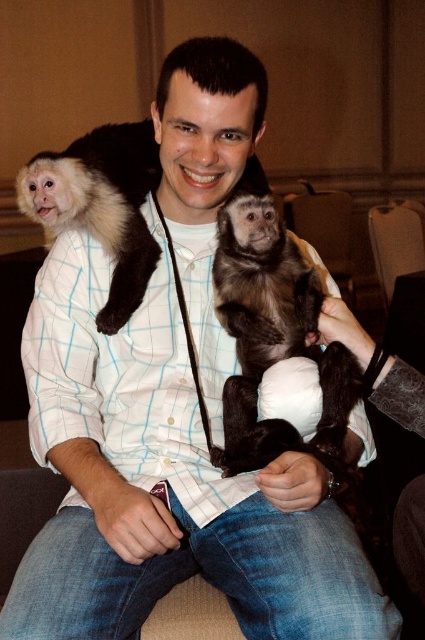
Does brown furry monkey at center have a smaller size compared to dark brown fur monkey at upper left?

Indeed, brown furry monkey at center has a smaller size compared to dark brown fur monkey at upper left.

Image resolution: width=425 pixels, height=640 pixels. What do you see at coordinates (274, 339) in the screenshot?
I see `brown furry monkey at center` at bounding box center [274, 339].

Does point (328, 458) come in front of point (47, 236)?

Yes, point (328, 458) is in front of point (47, 236).

Find the location of `brown furry monkey at center`. brown furry monkey at center is located at coordinates (274, 339).

Is brown furry monkey at center positioned before brown leather armchair at upper center?

That is True.

The height and width of the screenshot is (640, 425). What do you see at coordinates (274, 339) in the screenshot?
I see `brown furry monkey at center` at bounding box center [274, 339].

Find the location of `brown furry monkey at center`. brown furry monkey at center is located at coordinates (274, 339).

At what (x,y) coordinates should I click in order to perform the action: click on brown furry monkey at center. Please return your answer as a coordinate pair (x, y). The height and width of the screenshot is (640, 425). Looking at the image, I should click on (274, 339).

Is dark brown fur monkey at upper left taller than brown leather armchair at upper center?

Incorrect, dark brown fur monkey at upper left's height is not larger of brown leather armchair at upper center's.

This screenshot has height=640, width=425. What do you see at coordinates (101, 205) in the screenshot? I see `dark brown fur monkey at upper left` at bounding box center [101, 205].

At what (x,y) coordinates should I click in order to perform the action: click on dark brown fur monkey at upper left. Please return your answer as a coordinate pair (x, y). The height and width of the screenshot is (640, 425). Looking at the image, I should click on (101, 205).